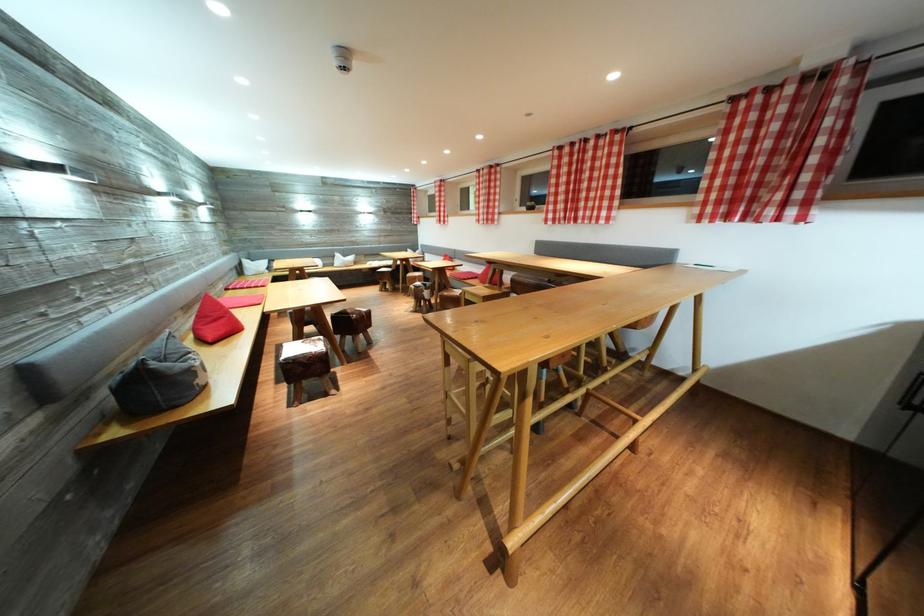
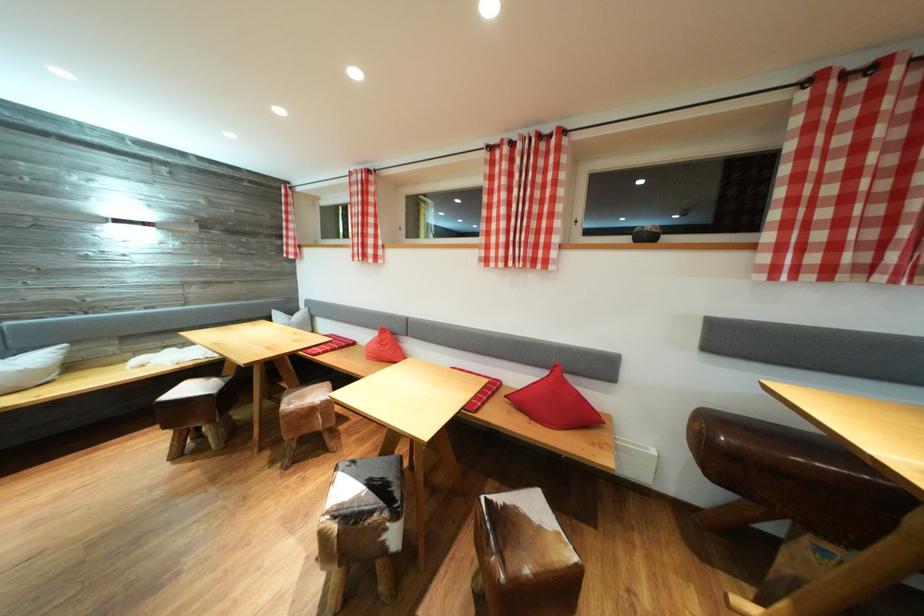
Question: Which direction would the cameraman need to move to produce the second image? Reply with the corresponding letter.

Choices:
 (A) Left
 (B) Right
 (C) Forward
 (D) Backward

Answer: (C)